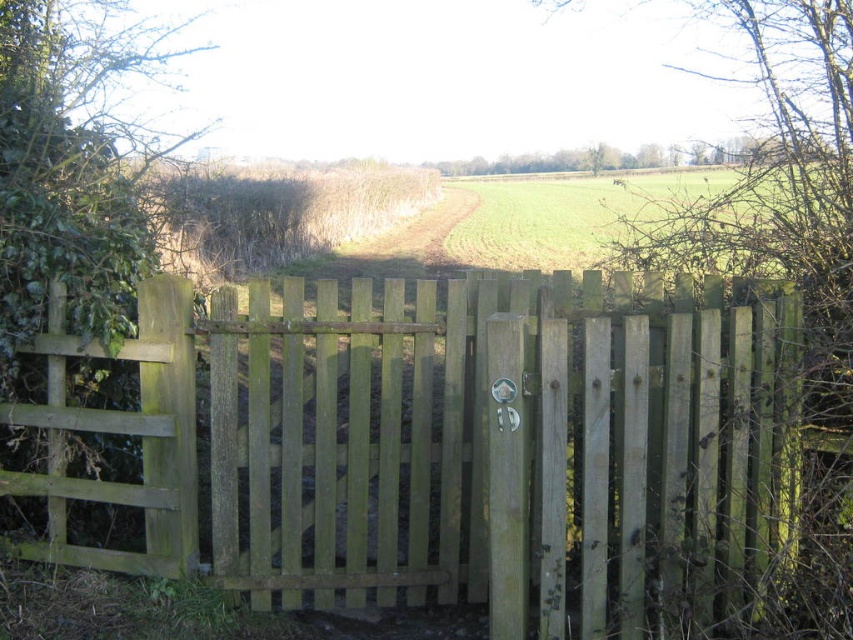
You are standing in front of the green wooden gate at center and the green grass field at center. Which one is located to the left side?

The green wooden gate at center is positioned on the left side of green grass field at center.

You are standing in front of the wooden gate and want to walk through to the green grass field at center. Which direction should you move relative to the brown dry hedge at center to reach the field?

To reach the green grass field at center, you should move to the right of the brown dry hedge at center since the brown dry hedge at center is to the left of the green grass field at center.